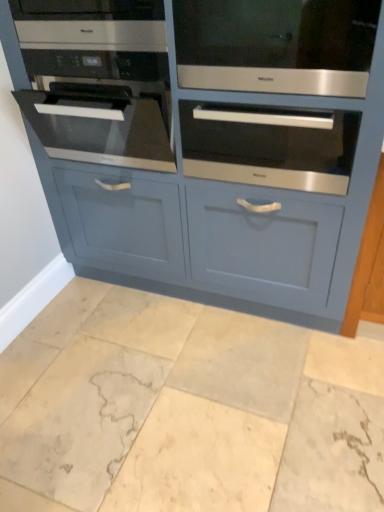
The image size is (384, 512). Describe the element at coordinates (276, 45) in the screenshot. I see `satin silver oven at upper center, which appears as the second oven when viewed from the right` at that location.

How much space does satin silver oven at center, which appears as the third oven when viewed from the left, occupy horizontally?

26.81 inches.

What is the approximate height of satin stainless steel oven at upper left?

It is 15.07 centimeters.

In order to click on matte blue cabinet at center in this screenshot , I will do `click(209, 143)`.

I want to click on marble tile at lower center, so click(x=187, y=409).

From the image's perspective, is marble tile at lower center located above satin silver oven at center, which appears as the third oven when viewed from the left?

No, from the image's perspective, marble tile at lower center is not on top of satin silver oven at center, which appears as the third oven when viewed from the left.

Is the depth of marble tile at lower center less than that of satin silver oven at center, which appears as the third oven when viewed from the left?

Yes, marble tile at lower center is closer to the viewer.

Is marble tile at lower center bigger or smaller than satin silver oven at center, the 1th oven from the right?

Clearly, marble tile at lower center is larger in size than satin silver oven at center, the 1th oven from the right.

How distant is marble tile at lower center from satin silver oven at center, the 1th oven from the right?

marble tile at lower center is 87.73 centimeters away from satin silver oven at center, the 1th oven from the right.

Does point (293, 147) come in front of point (308, 24)?

No, (293, 147) is further to viewer.

From a real-world perspective, is satin silver oven at center, the 1th oven from the right, beneath matte blue cabinet at center?

No, from a real-world perspective, satin silver oven at center, the 1th oven from the right, is not below matte blue cabinet at center.

Based on the photo, between satin silver oven at center, which appears as the third oven when viewed from the left, and matte blue cabinet at center, which one has less height?

satin silver oven at center, which appears as the third oven when viewed from the left.

Is matte blue cabinet at center located within satin silver oven at center, which appears as the third oven when viewed from the left?

No.

Based on the photo, is satin silver oven at center, the 1th oven from the right, far away from satin stainless steel oven at upper left?

No, satin silver oven at center, the 1th oven from the right, is not far away from satin stainless steel oven at upper left.

Would you say satin silver oven at center, the 1th oven from the right, is inside or outside satin stainless steel oven at upper left?

satin silver oven at center, the 1th oven from the right, exists outside the volume of satin stainless steel oven at upper left.

From a real-world perspective, which is physically below, satin silver oven at center, the 1th oven from the right, or satin stainless steel oven at upper left?

In real-world perspective, satin silver oven at center, the 1th oven from the right, is lower.

Who is shorter, satin silver oven at center, which appears as the third oven when viewed from the left, or satin stainless steel oven at upper left?

Standing shorter between the two is satin stainless steel oven at upper left.

Is satin silver oven at upper center, which appears as the second oven when viewed from the right, not inside satin stainless steel oven at upper left?

That's correct, satin silver oven at upper center, which appears as the second oven when viewed from the right, is outside of satin stainless steel oven at upper left.

From a real-world perspective, who is located higher, satin silver oven at upper center, which is the 2th oven in left-to-right order, or satin stainless steel oven at upper left?

satin stainless steel oven at upper left, from a real-world perspective.

Which is behind, point (258, 29) or point (44, 13)?

The point (44, 13) is farther from the camera.

Which is more to the right, satin silver oven at upper center, which is the 2th oven in left-to-right order, or satin stainless steel oven at upper left?

satin silver oven at upper center, which is the 2th oven in left-to-right order, is more to the right.

Between matte blue cabinet at center and marble tile at lower center, which one has larger size?

matte blue cabinet at center.

Looking at this image, is matte blue cabinet at center wider than marble tile at lower center?

Incorrect, the width of matte blue cabinet at center does not surpass that of marble tile at lower center.

Can you confirm if matte blue cabinet at center is taller than marble tile at lower center?

Indeed, matte blue cabinet at center has a greater height compared to marble tile at lower center.

Can you confirm if matte blue cabinet at center is positioned to the right of marble tile at lower center?

Yes.

From the image's perspective, would you say satin silver oven at center, which appears as the third oven when viewed from the left, is positioned over satin silver oven at upper center, which is the 2th oven in left-to-right order?

No, from the image's perspective, satin silver oven at center, which appears as the third oven when viewed from the left, is not over satin silver oven at upper center, which is the 2th oven in left-to-right order.

Is satin silver oven at center, which appears as the third oven when viewed from the left, at the left side of satin silver oven at upper center, which appears as the second oven when viewed from the right?

In fact, satin silver oven at center, which appears as the third oven when viewed from the left, is to the right of satin silver oven at upper center, which appears as the second oven when viewed from the right.

Can you tell me how much satin silver oven at center, which appears as the third oven when viewed from the left, and satin silver oven at upper center, which appears as the second oven when viewed from the right, differ in facing direction?

satin silver oven at center, which appears as the third oven when viewed from the left, and satin silver oven at upper center, which appears as the second oven when viewed from the right, are facing 0.468 degrees away from each other.

Does satin silver oven at center, the 1th oven from the right, have a lesser width compared to satin silver oven at upper center, which appears as the second oven when viewed from the right?

Incorrect, the width of satin silver oven at center, the 1th oven from the right, is not less than that of satin silver oven at upper center, which appears as the second oven when viewed from the right.

Does satin silver oven at upper center, which appears as the second oven when viewed from the right, have a lesser width compared to satin silver oven at center, the 1th oven from the right?

Correct, the width of satin silver oven at upper center, which appears as the second oven when viewed from the right, is less than that of satin silver oven at center, the 1th oven from the right.

Can you see satin silver oven at upper center, which is the 2th oven in left-to-right order, touching satin silver oven at center, which appears as the third oven when viewed from the left?

There is a gap between satin silver oven at upper center, which is the 2th oven in left-to-right order, and satin silver oven at center, which appears as the third oven when viewed from the left.

Considering the sizes of objects satin silver oven at upper center, which is the 2th oven in left-to-right order, and satin silver oven at center, the 1th oven from the right, in the image provided, who is smaller, satin silver oven at upper center, which is the 2th oven in left-to-right order, or satin silver oven at center, the 1th oven from the right,?

Smaller between the two is satin silver oven at upper center, which is the 2th oven in left-to-right order.

From the image's perspective, which object appears higher, satin silver oven at upper center, which appears as the second oven when viewed from the right, or satin silver oven at center, which appears as the third oven when viewed from the left?

satin silver oven at upper center, which appears as the second oven when viewed from the right, appears higher in the image.

The height and width of the screenshot is (512, 384). Identify the location of ceramic tile that appears below the satin silver oven at center, which appears as the third oven when viewed from the left (from a real-world perspective). (187, 409).

Starting from the matte blue cabinet at center, which oven is the 2nd one behind? Please provide its 2D coordinates.

[(269, 145)]

When comparing their distances from satin silver oven at center, which appears as the third oven when viewed from the left, does marble tile at lower center or satin black oven at left, which is the 3th oven in right-to-left order, seem closer?

Based on the image, satin black oven at left, which is the 3th oven in right-to-left order, appears to be nearer to satin silver oven at center, which appears as the third oven when viewed from the left.

From the image, which object appears to be nearer to satin silver oven at upper center, which is the 2th oven in left-to-right order, marble tile at lower center or satin stainless steel oven at upper left?

satin stainless steel oven at upper left.

Based on their spatial positions, is satin black oven at left, placed as the first oven when sorted from left to right, or satin stainless steel oven at upper left closer to marble tile at lower center?

satin black oven at left, placed as the first oven when sorted from left to right, lies closer to marble tile at lower center than the other object.

From the image, which object appears to be nearer to satin silver oven at center, which appears as the third oven when viewed from the left, satin silver oven at upper center, which is the 2th oven in left-to-right order, or satin black oven at left, placed as the first oven when sorted from left to right?

satin silver oven at upper center, which is the 2th oven in left-to-right order, is closer to satin silver oven at center, which appears as the third oven when viewed from the left.

Which object lies nearer to the anchor point satin silver oven at center, the 1th oven from the right, matte blue cabinet at center or marble tile at lower center?

Among the two, matte blue cabinet at center is located nearer to satin silver oven at center, the 1th oven from the right.

Based on the photo, based on their spatial positions, is satin stainless steel oven at upper left or matte blue cabinet at center further from marble tile at lower center?

satin stainless steel oven at upper left lies further to marble tile at lower center than the other object.

Based on their spatial positions, is satin stainless steel oven at upper left or satin silver oven at upper center, which appears as the second oven when viewed from the right, closer to satin black oven at left, placed as the first oven when sorted from left to right?

satin stainless steel oven at upper left is positioned closer to the anchor satin black oven at left, placed as the first oven when sorted from left to right.

From the image, which object appears to be farther from satin stainless steel oven at upper left, satin silver oven at center, which appears as the third oven when viewed from the left, or satin black oven at left, placed as the first oven when sorted from left to right?

Among the two, satin silver oven at center, which appears as the third oven when viewed from the left, is located further to satin stainless steel oven at upper left.

Where is `cabinetry between satin silver oven at upper center, which appears as the second oven when viewed from the right, and marble tile at lower center from top to bottom`? This screenshot has height=512, width=384. cabinetry between satin silver oven at upper center, which appears as the second oven when viewed from the right, and marble tile at lower center from top to bottom is located at coordinates (209, 143).

Locate an element on the screen. appliance situated between satin black oven at left, placed as the first oven when sorted from left to right, and satin silver oven at upper center, which is the 2th oven in left-to-right order, from left to right is located at coordinates (90, 24).

I want to click on cabinetry between satin black oven at left, which is the 3th oven in right-to-left order, and marble tile at lower center in the up-down direction, so click(x=209, y=143).

Image resolution: width=384 pixels, height=512 pixels. Find the location of `cabinetry between satin stainless steel oven at upper left and satin silver oven at upper center, which appears as the second oven when viewed from the right, in the horizontal direction`. cabinetry between satin stainless steel oven at upper left and satin silver oven at upper center, which appears as the second oven when viewed from the right, in the horizontal direction is located at coordinates (209, 143).